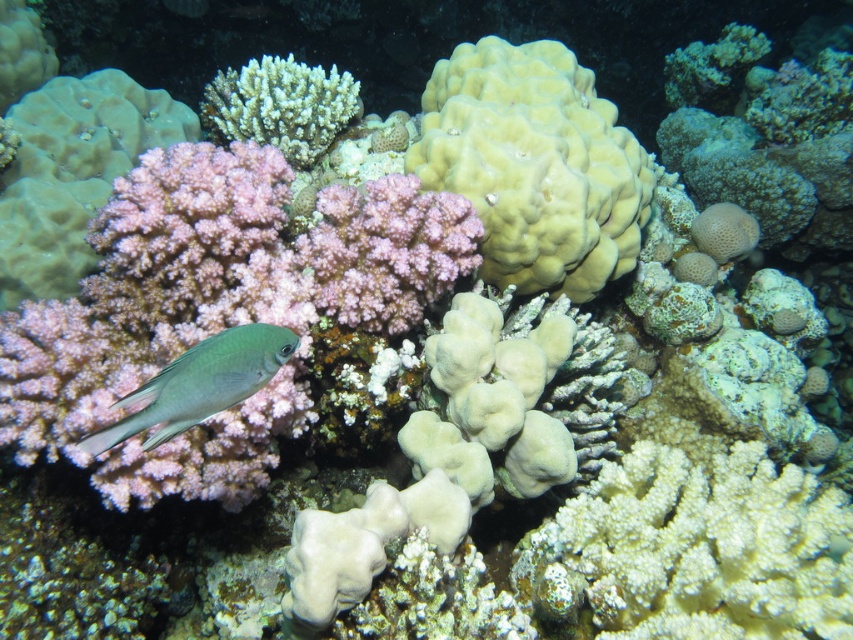
Question: Which point is closer to the camera?

Choices:
 (A) (560, 211)
 (B) (265, 337)

Answer: (B)

Question: Among these points, which one is nearest to the camera?

Choices:
 (A) (520, 108)
 (B) (251, 380)
 (C) (215, 132)

Answer: (B)

Question: Among these objects, which one is nearest to the camera?

Choices:
 (A) green matte fish at lower left
 (B) white coral at upper center

Answer: (A)

Question: Does yellow matte coral at center appear under green matte fish at lower left?

Choices:
 (A) yes
 (B) no

Answer: (B)

Question: Is yellow matte coral at center closer to the viewer compared to white coral at upper center?

Choices:
 (A) yes
 (B) no

Answer: (A)

Question: In this image, where is white coral at upper center located relative to green matte fish at lower left?

Choices:
 (A) above
 (B) below

Answer: (A)